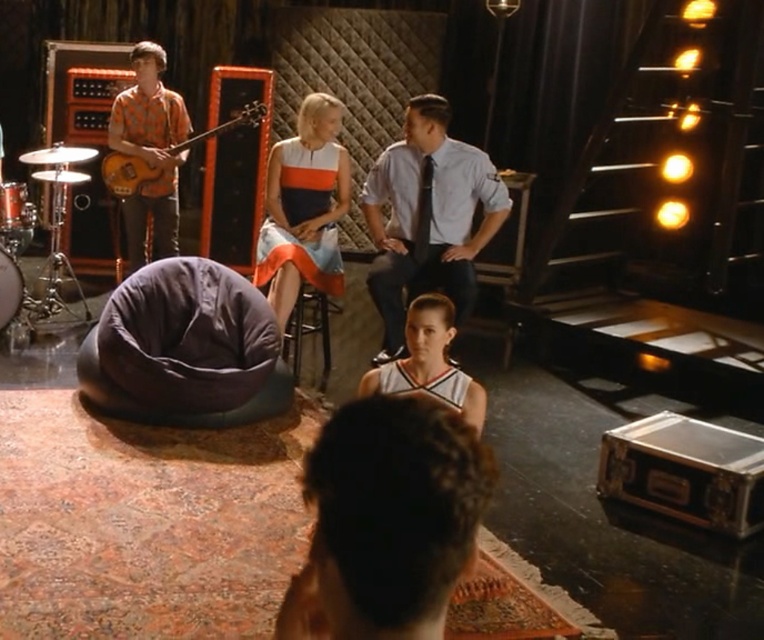
Question: Which point is farther from the camera taking this photo?

Choices:
 (A) (170, 401)
 (B) (431, 211)

Answer: (B)

Question: Does brown curly hair at center have a greater width compared to white jersey at center?

Choices:
 (A) yes
 (B) no

Answer: (B)

Question: Is orange wood guitar at upper left thinner than brushed metal drum at left?

Choices:
 (A) no
 (B) yes

Answer: (A)

Question: Does brown curly hair at center have a larger size compared to brushed metal drum at lower left?

Choices:
 (A) no
 (B) yes

Answer: (B)

Question: Among these points, which one is nearest to the camera?

Choices:
 (A) (364, 396)
 (B) (130, 198)
 (C) (429, 220)
 (D) (23, 288)

Answer: (A)

Question: Estimate the real-world distances between objects in this image. Which object is closer to the orange patterned shirt at left?

Choices:
 (A) brushed metal drum at left
 (B) brushed metal drum at lower left
 (C) orange wood guitar at upper left
 (D) white jersey at center

Answer: (C)